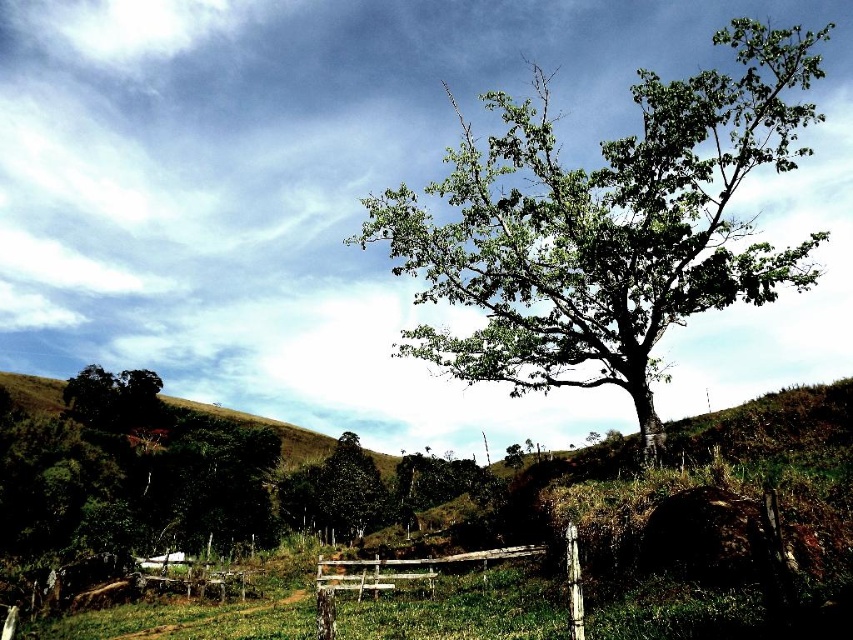
You are a hiker trying to determine which tree is taller between the green leafy tree at center and the dark green leafy tree at lower left. Based on the scene, which one is taller?

The green leafy tree at center is taller than the dark green leafy tree at lower left according to the description.

You are a bird looking for a place to perch. You see the green leafy tree at center and the wooden fence at lower center. Which one offers a higher spot to rest?

The green leafy tree at center is much taller than the wooden fence at lower center, so it offers a higher spot to rest.

You are a painter setting up an easel to paint the scene. You want to ensure the wooden fence at lower center and the dark green leafy tree at lower left are both visible in your painting. Based on their positions, which object should you place higher on your canvas?

The wooden fence at lower center should be placed higher on the canvas because it is positioned above the dark green leafy tree at lower left in the scene.